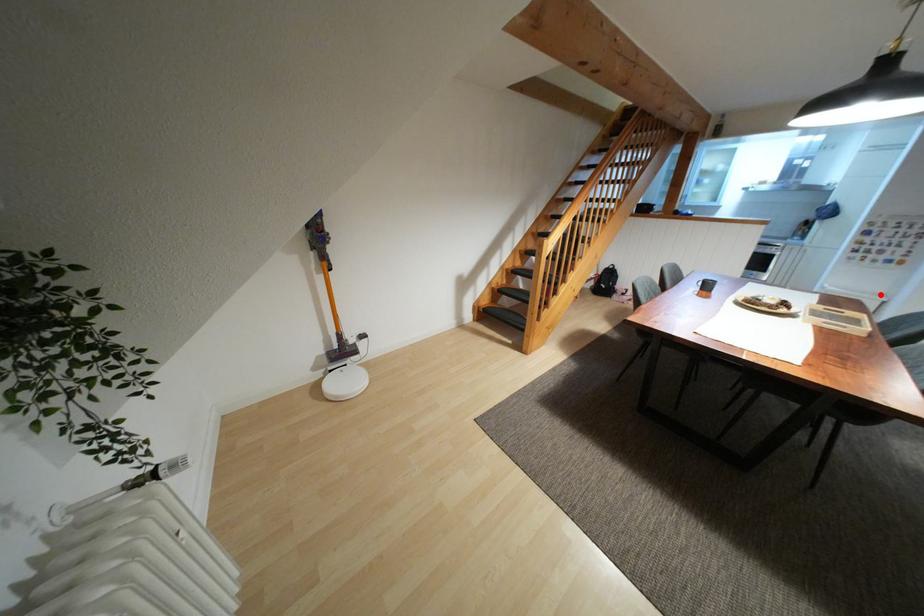
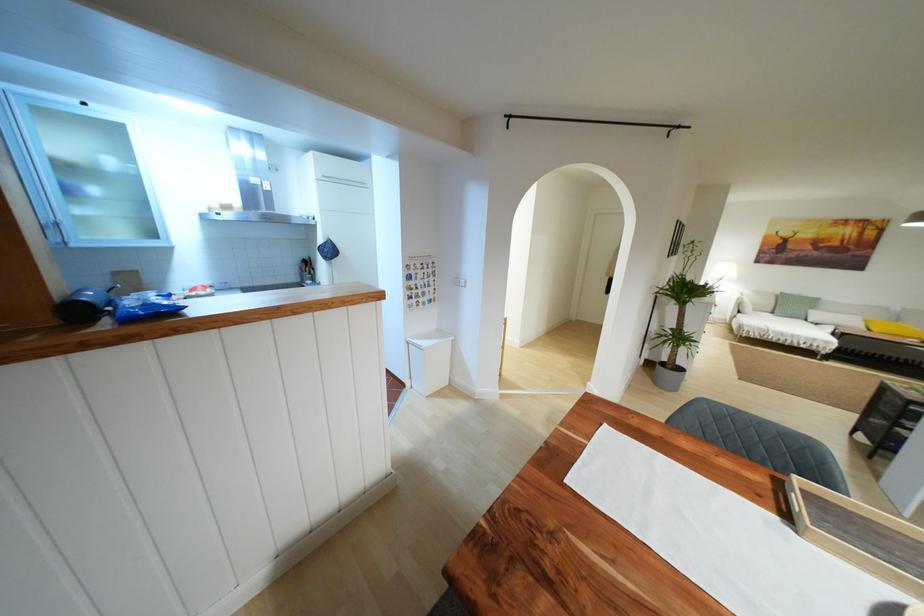
Question: I am providing you with two images of the same scene from different viewpoints. Image1 has a red point marked. In image2, the corresponding 3D location appears at what relative position? Reply with the corresponding letter.

Choices:
 (A) Closer
 (B) Farther

Answer: (A)